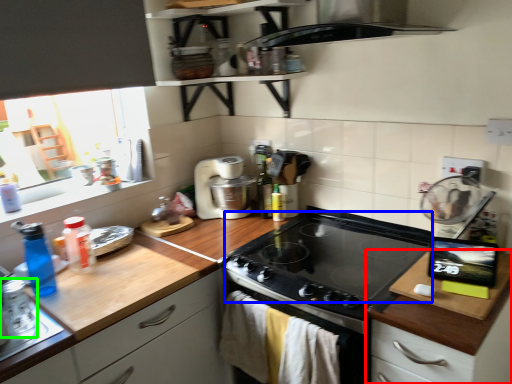
Question: Based on their relative distances, which object is nearer to cabinetry (highlighted by a red box)? Choose from gas stove (highlighted by a blue box) and appliance (highlighted by a green box).

Choices:
 (A) gas stove
 (B) appliance

Answer: (A)